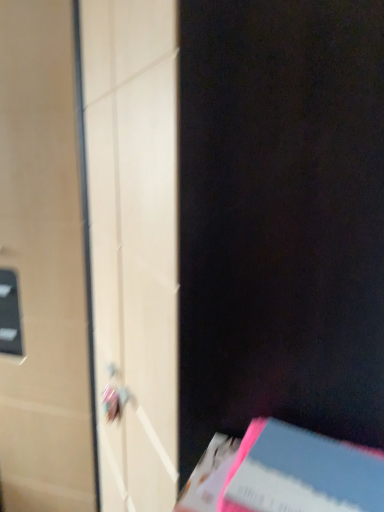
Question: From the image's perspective, is pink matte paper at lower right positioned above or below matte white door at left?

Choices:
 (A) below
 (B) above

Answer: (A)

Question: Is point (329, 489) positioned closer to the camera than point (79, 232)?

Choices:
 (A) closer
 (B) farther

Answer: (A)

Question: Relative to matte white door at left, is pink matte paper at lower right in front or behind?

Choices:
 (A) front
 (B) behind

Answer: (A)

Question: Is matte white door at left bigger or smaller than pink matte paper at lower right?

Choices:
 (A) small
 (B) big

Answer: (B)

Question: Looking at their shapes, would you say matte white door at left is wider or thinner than pink matte paper at lower right?

Choices:
 (A) wide
 (B) thin

Answer: (A)

Question: Is point [34, 501] closer or farther from the camera than point [332, 507]?

Choices:
 (A) farther
 (B) closer

Answer: (A)

Question: Based on their positions, is matte white door at left located to the left or right of pink matte paper at lower right?

Choices:
 (A) right
 (B) left

Answer: (B)